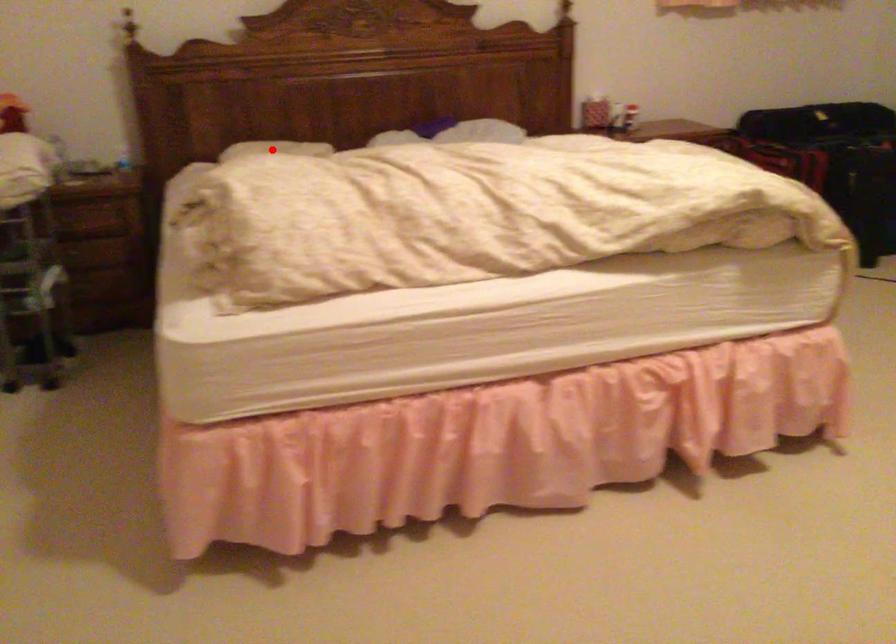
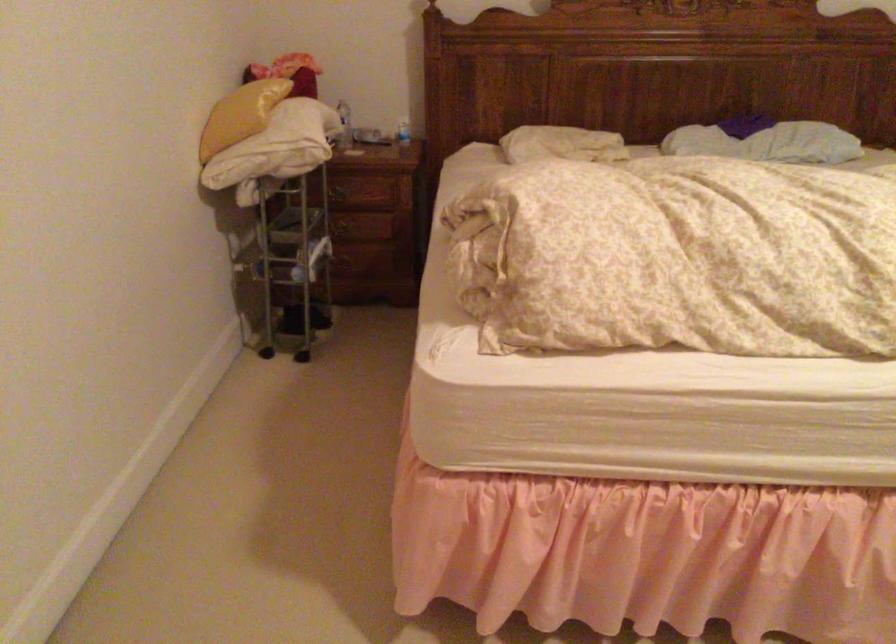
Find the pixel in the second image that matches the highlighted location in the first image.

(561, 144)